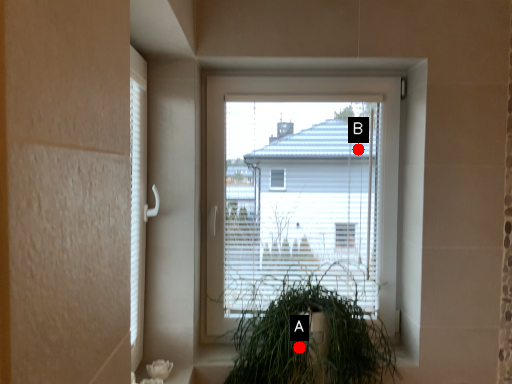
Question: Two points are circled on the image, labeled by A and B beside each circle. Which point appears farthest from the camera in this image?

Choices:
 (A) A is further
 (B) B is further

Answer: (B)